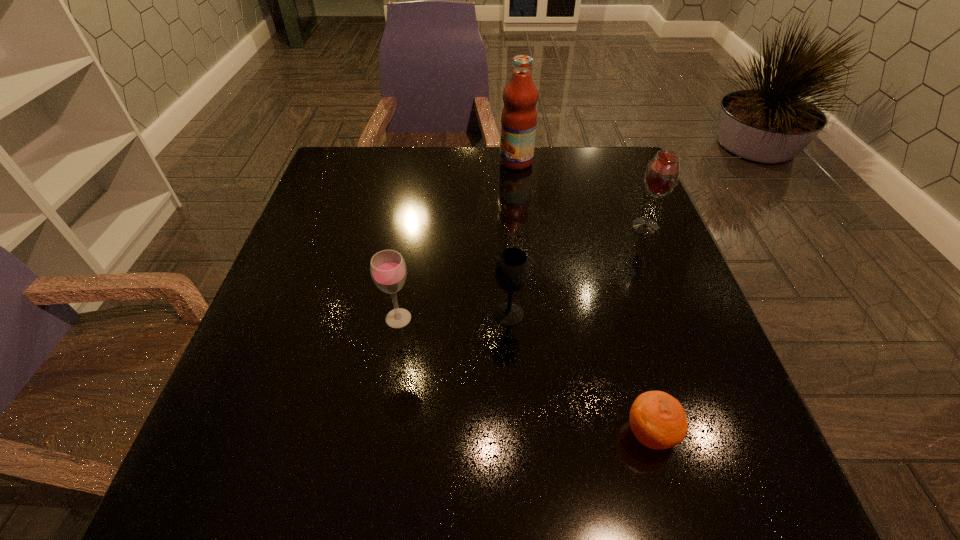
Identify the location of the farthest object. pyautogui.click(x=519, y=115).

In order to click on fruit juice in this screenshot , I will do `click(519, 115)`.

In order to click on the second farthest object in this screenshot , I will do `click(662, 174)`.

This screenshot has width=960, height=540. Find the location of `the farthest wineglass`. the farthest wineglass is located at coordinates (662, 174).

Where is `the leftmost wineglass`? This screenshot has width=960, height=540. the leftmost wineglass is located at coordinates (388, 270).

The height and width of the screenshot is (540, 960). I want to click on the second wineglass from left to right, so click(x=511, y=269).

The image size is (960, 540). In order to click on the shortest object in this screenshot , I will do `click(658, 420)`.

Locate an element on the screen. The width and height of the screenshot is (960, 540). the fourth object from left to right is located at coordinates (658, 420).

Identify the location of vacant space situated 0.250m on the front label of the tallest object. click(x=413, y=161).

The height and width of the screenshot is (540, 960). I want to click on vacant point located 0.200m on the front label of the tallest object, so click(x=430, y=161).